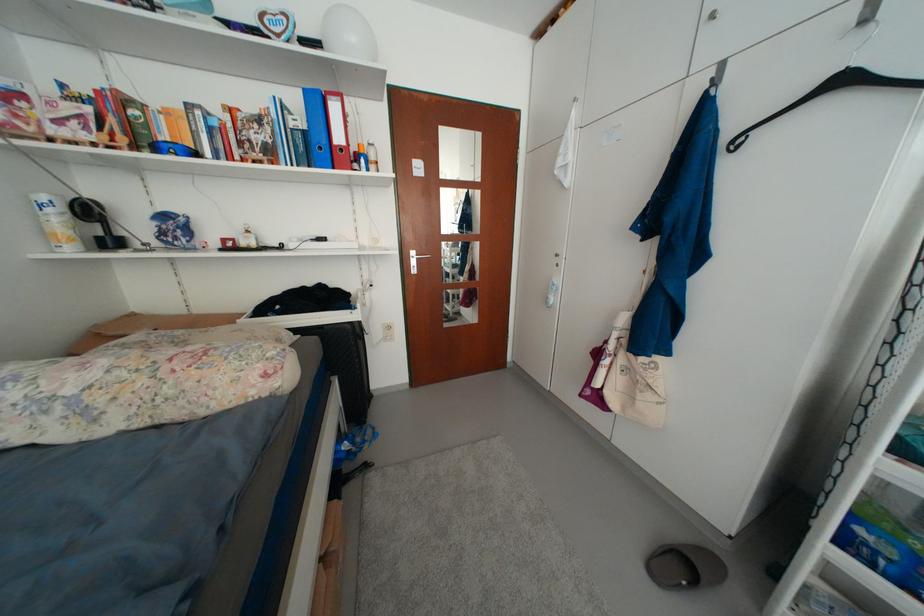
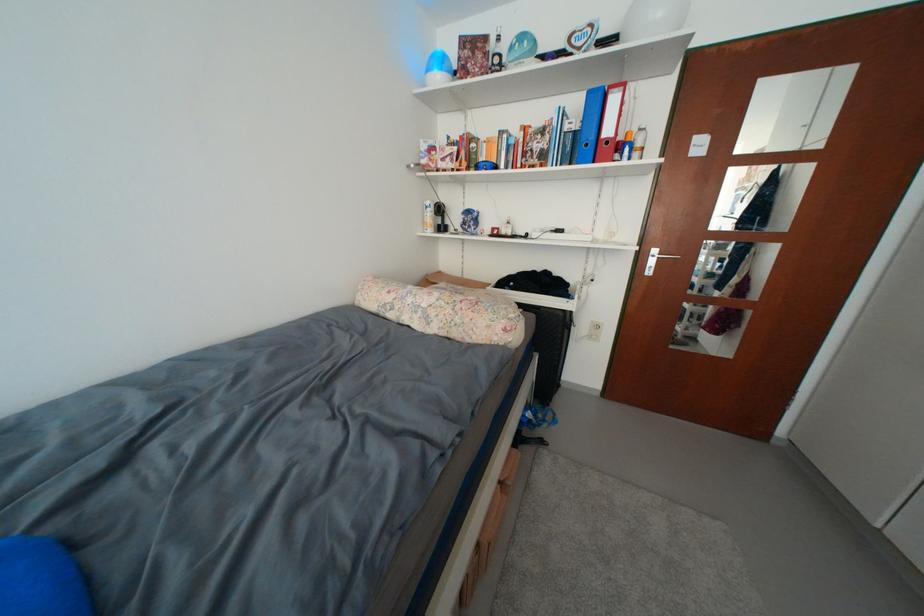
Locate, in the second image, the point that corresponds to (x=365, y=168) in the first image.

(626, 159)